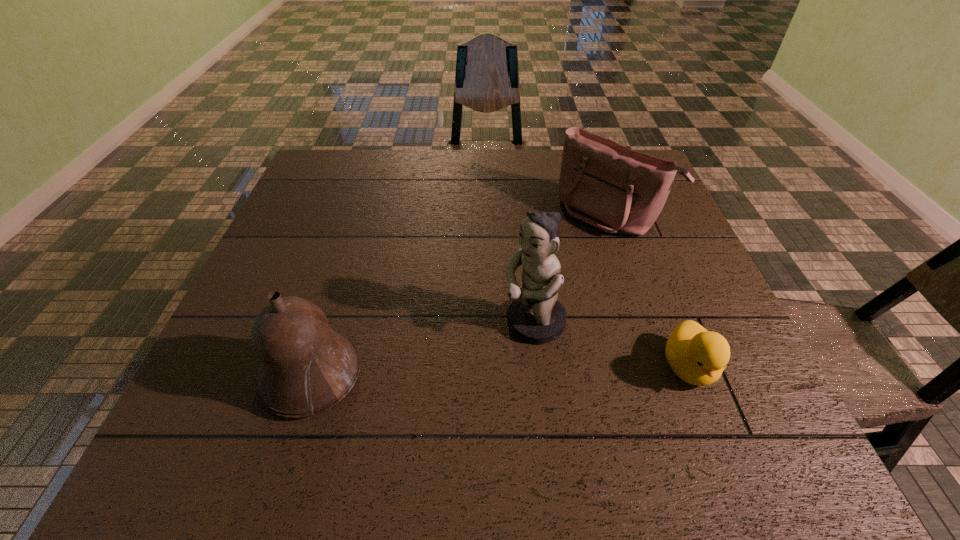
Identify the location of free space located on the front-facing side of the tallest object. This screenshot has height=540, width=960. (477, 355).

Where is `free location located 0.280m on the front-facing side of the tallest object`? free location located 0.280m on the front-facing side of the tallest object is located at coordinates (385, 407).

You are a GUI agent. You are given a task and a screenshot of the screen. Output one action in this format:
    pyautogui.click(x=<x>, y=<y>)
    Task: Click on the object located at the far edge
    
    Given the screenshot: What is the action you would take?
    pyautogui.click(x=602, y=183)

You are a GUI agent. You are given a task and a screenshot of the screen. Output one action in this format:
    pyautogui.click(x=<x>, y=<y>)
    Task: Click on the bell situated at the near edge
    This screenshot has height=540, width=960.
    Given the screenshot: What is the action you would take?
    pyautogui.click(x=305, y=368)

Locate an element on the screen. The height and width of the screenshot is (540, 960). duck situated at the near edge is located at coordinates (697, 356).

You are a GUI agent. You are given a task and a screenshot of the screen. Output one action in this format:
    pyautogui.click(x=<x>, y=<y>)
    Task: Click on the object present at the left edge
    Image resolution: width=960 pixels, height=540 pixels.
    Given the screenshot: What is the action you would take?
    click(x=305, y=368)

At what (x,y) coordinates should I click in order to perform the action: click on duck present at the right edge. Please return your answer as a coordinate pair (x, y). This screenshot has height=540, width=960. Looking at the image, I should click on (697, 356).

This screenshot has width=960, height=540. Find the location of `shoulder bag at the right edge`. shoulder bag at the right edge is located at coordinates (602, 183).

Locate an element on the screen. object that is at the near left corner is located at coordinates (305, 368).

The image size is (960, 540). I want to click on object positioned at the far right corner, so click(602, 183).